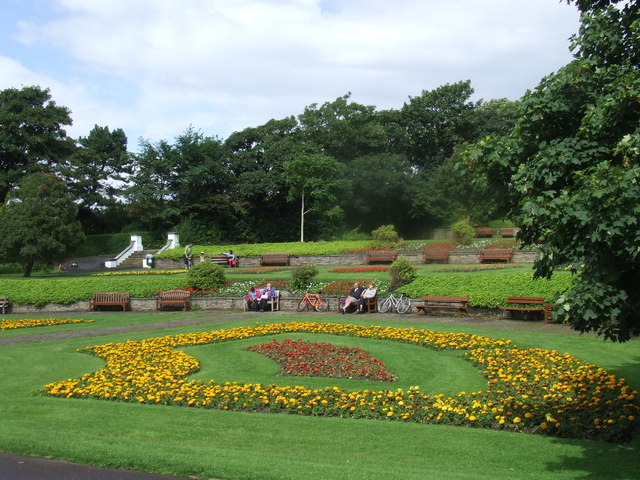
At what (x,y) coordinates should I click in order to perform the action: click on wall. Please return your answer as a coordinate pair (x, y). The image size is (640, 480). Looking at the image, I should click on (223, 303), (139, 301), (166, 258), (248, 259), (326, 260), (406, 252), (524, 256), (470, 256), (481, 309).